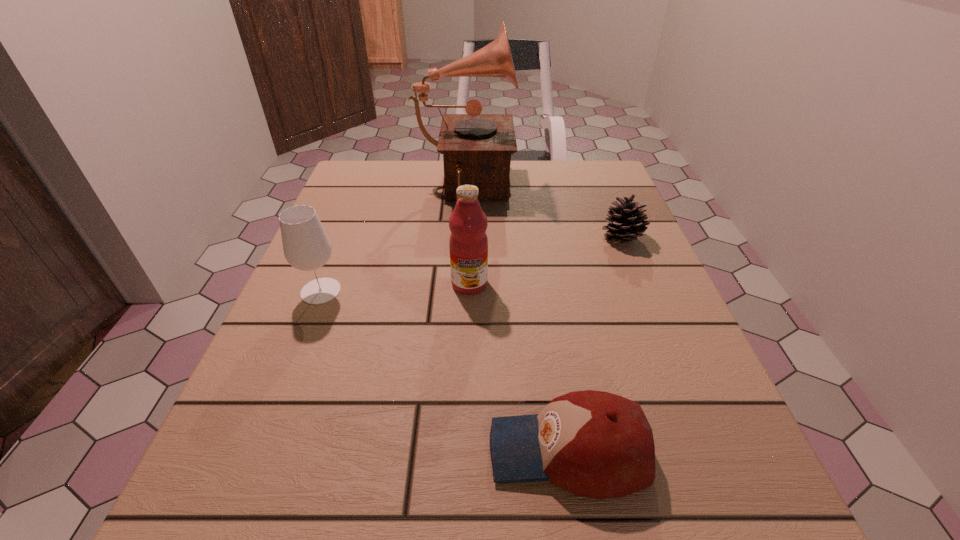
The height and width of the screenshot is (540, 960). In order to click on the tallest object in this screenshot , I will do `click(476, 148)`.

I want to click on the second tallest object, so click(x=468, y=243).

This screenshot has width=960, height=540. Identify the location of the leftmost object. (306, 246).

This screenshot has height=540, width=960. Find the location of `glass`. glass is located at coordinates (306, 246).

At what (x,y) coordinates should I click in order to perform the action: click on the rightmost object. Please return your answer as a coordinate pair (x, y). Looking at the image, I should click on (626, 221).

Find the location of a particular element. Image resolution: width=960 pixels, height=540 pixels. the nearest object is located at coordinates (595, 444).

Where is `free space located 0.130m on the horn of the record player`? free space located 0.130m on the horn of the record player is located at coordinates (565, 192).

Locate an element on the screen. blank area located 0.280m on the label of the second tallest object is located at coordinates coord(466,430).

Image resolution: width=960 pixels, height=540 pixels. I want to click on vacant space located on the back of the third tallest object, so click(x=346, y=229).

Identify the location of vacant area located 0.360m on the left of the rightmost object. (439, 238).